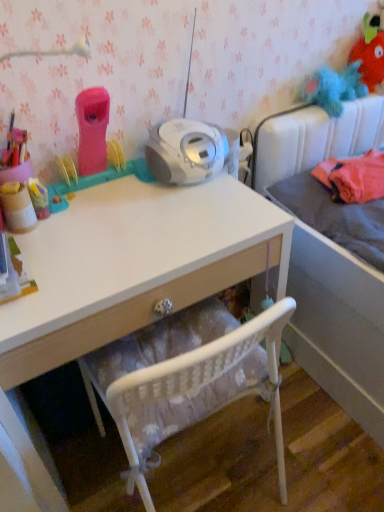
What are the coordinates of `free point above white glossy desk at center (from a real-world perspective)` in the screenshot? It's located at (122, 224).